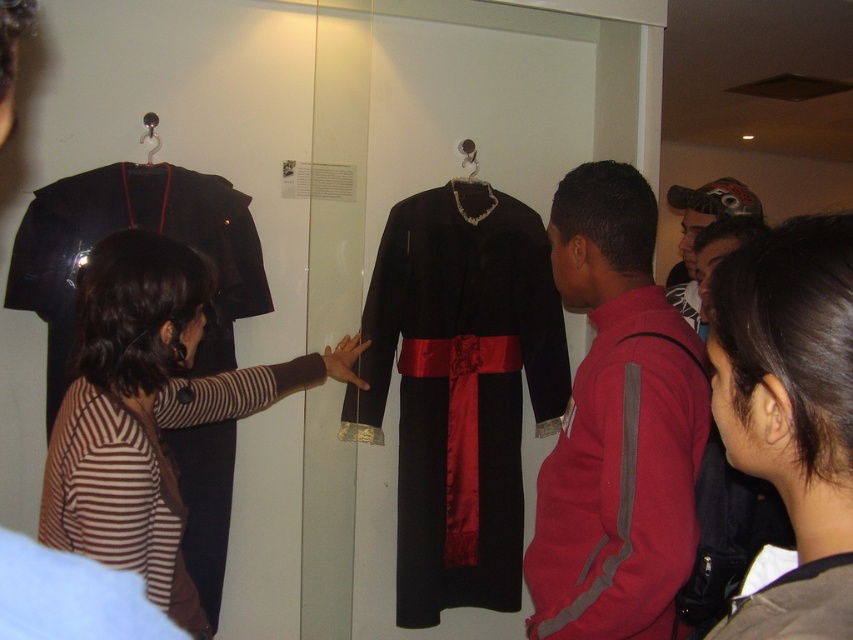
Is point (601, 502) more distant than point (824, 276)?

Yes, point (601, 502) is behind point (824, 276).

What do you see at coordinates (618, 428) in the screenshot?
I see `red fleece jacket at center` at bounding box center [618, 428].

Which is behind, point (691, 422) or point (822, 552)?

The point (691, 422) is more distant.

Locate an element on the screen. This screenshot has width=853, height=640. red fleece jacket at center is located at coordinates (618, 428).

Does red fleece jacket at center lie behind velvet-like fabric robe at center?

Yes, it is behind velvet-like fabric robe at center.

Is red fleece jacket at center above velvet-like fabric robe at center?

Correct, red fleece jacket at center is located above velvet-like fabric robe at center.

Who is more distant from viewer, [546,460] or [793,592]?

The point [546,460] is more distant.

The height and width of the screenshot is (640, 853). I want to click on red fleece jacket at center, so click(618, 428).

Does velvet-like fabric robe at center have a lesser height compared to matte black jacket at center?

Yes, velvet-like fabric robe at center is shorter than matte black jacket at center.

Which of these two, velvet-like fabric robe at center or matte black jacket at center, stands taller?

Standing taller between the two is matte black jacket at center.

Image resolution: width=853 pixels, height=640 pixels. What do you see at coordinates (796, 604) in the screenshot?
I see `velvet-like fabric robe at center` at bounding box center [796, 604].

What are the coordinates of `velvet-like fabric robe at center` in the screenshot? It's located at (796, 604).